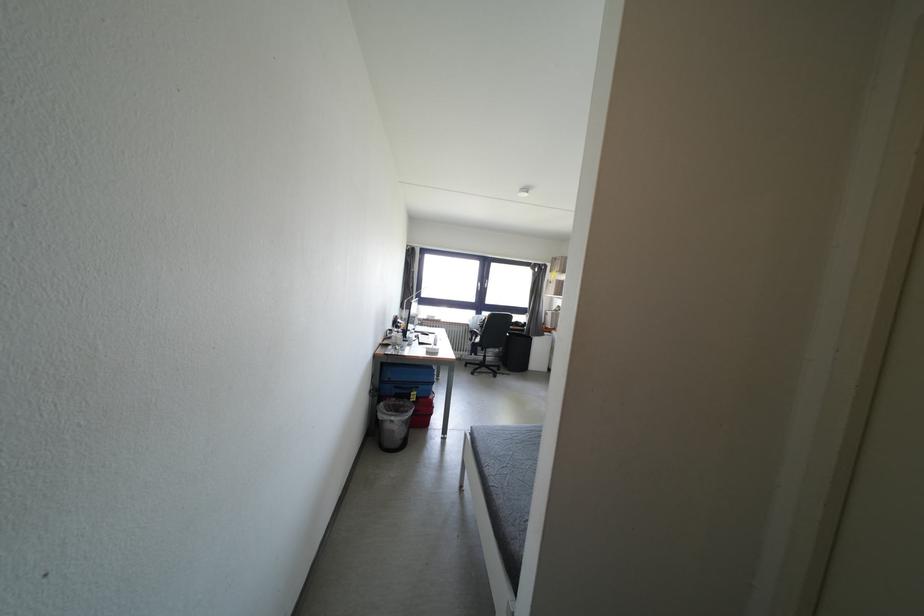
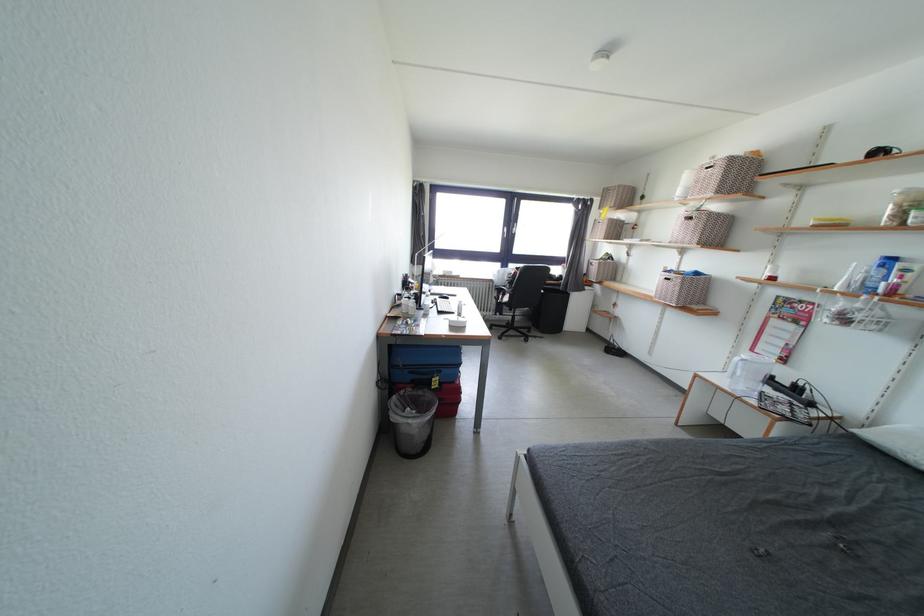
Question: Based on the continuous images, in which direction is the camera rotating? Reply with the corresponding letter.

Choices:
 (A) Left
 (B) Right
 (C) Up
 (D) Down

Answer: (D)